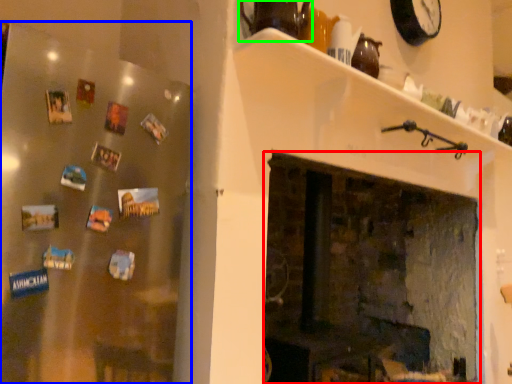
Question: Which is nearer to the fireplace (highlighted by a red box)? fridge (highlighted by a blue box) or tea pot (highlighted by a green box).

Choices:
 (A) fridge
 (B) tea pot

Answer: (B)